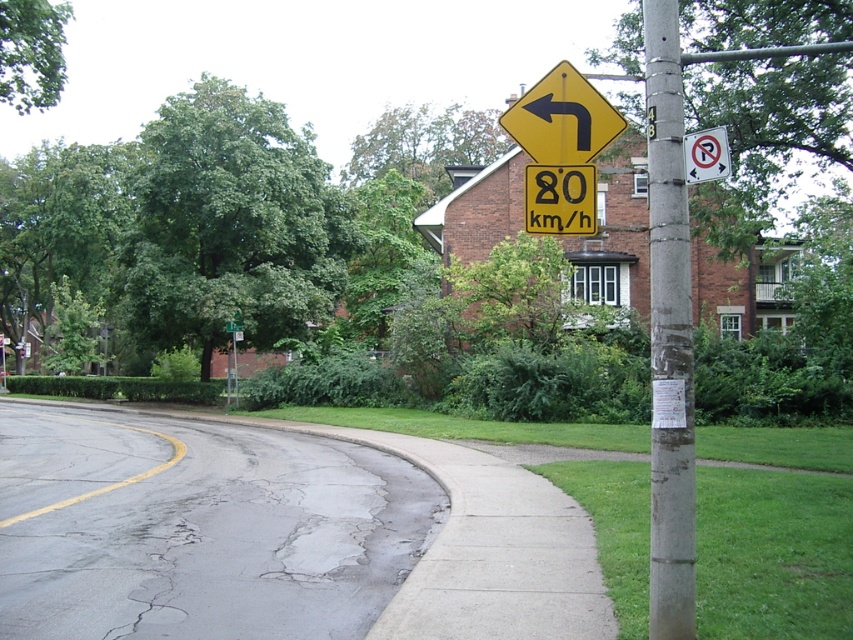
Is gray asphalt road at lower left thinner than yellow matte sign at upper center?

Incorrect, gray asphalt road at lower left's width is not less than yellow matte sign at upper center's.

From the picture: Does gray asphalt road at lower left appear over yellow matte sign at upper center?

No, gray asphalt road at lower left is not above yellow matte sign at upper center.

Locate an element on the screen. gray asphalt road at lower left is located at coordinates (x=199, y=529).

Where is `gray asphalt road at lower left`? This screenshot has width=853, height=640. gray asphalt road at lower left is located at coordinates (199, 529).

The image size is (853, 640). Describe the element at coordinates (560, 198) in the screenshot. I see `yellow plastic speed limit sign at upper center` at that location.

Which is behind, point (589, 192) or point (228, 326)?

Positioned behind is point (228, 326).

Find the location of a particular element. yellow plastic speed limit sign at upper center is located at coordinates (560, 198).

Who is more forward, (581, 100) or (570, 208)?

Positioned in front is point (581, 100).

This screenshot has height=640, width=853. I want to click on yellow matte sign at upper center, so click(561, 118).

What do you see at coordinates (561, 118) in the screenshot?
I see `yellow matte sign at upper center` at bounding box center [561, 118].

This screenshot has width=853, height=640. Find the location of `yellow matte sign at upper center`. yellow matte sign at upper center is located at coordinates (561, 118).